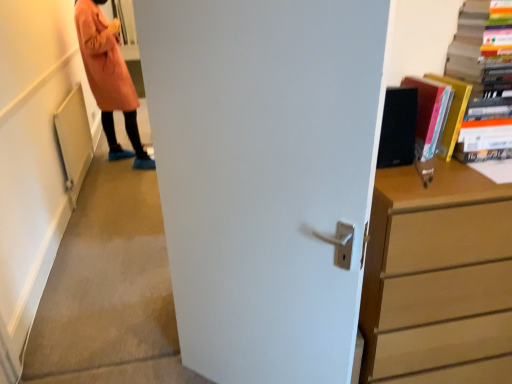
Question: Is matte black book at upper right, which is counted as the first book, starting from the left, wider or thinner than hardcover book at upper right, which appears as the 1th book when viewed from the right?

Choices:
 (A) wide
 (B) thin

Answer: (B)

Question: From a real-world perspective, is matte black book at upper right, placed as the second book when sorted from right to left, above or below hardcover book at upper right, which appears as the 1th book when viewed from the right?

Choices:
 (A) below
 (B) above

Answer: (A)

Question: Which object is positioned farthest from the white matte door at center?

Choices:
 (A) hardcover book at upper right, which appears as the 1th book when viewed from the right
 (B) wooden chest of drawers at right
 (C) matte black book at upper right, placed as the second book when sorted from right to left

Answer: (A)

Question: Based on their relative distances, which object is farther from the white matte door at center?

Choices:
 (A) matte black book at upper right, which is counted as the first book, starting from the left
 (B) hardcover book at upper right, placed as the second book when sorted from left to right
 (C) wooden chest of drawers at right

Answer: (B)